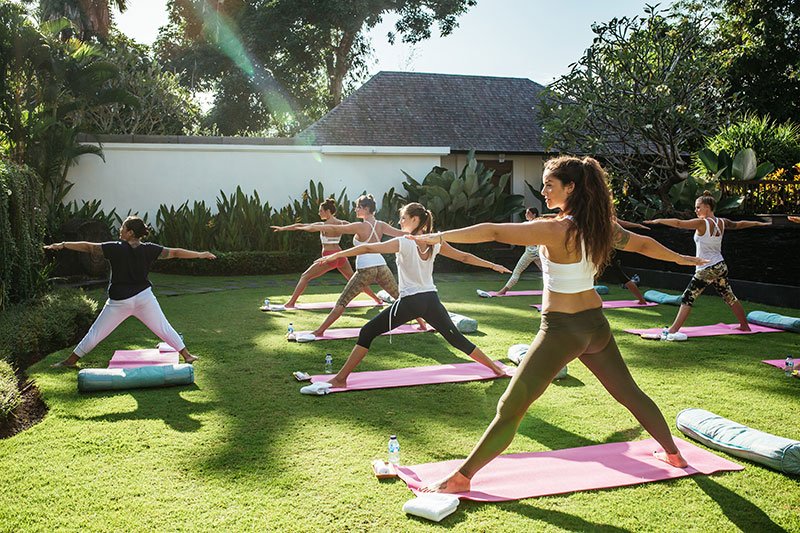
In order to click on yoga pillows in this screenshot , I will do `click(717, 432)`, `click(772, 316)`, `click(661, 294)`, `click(118, 370)`.